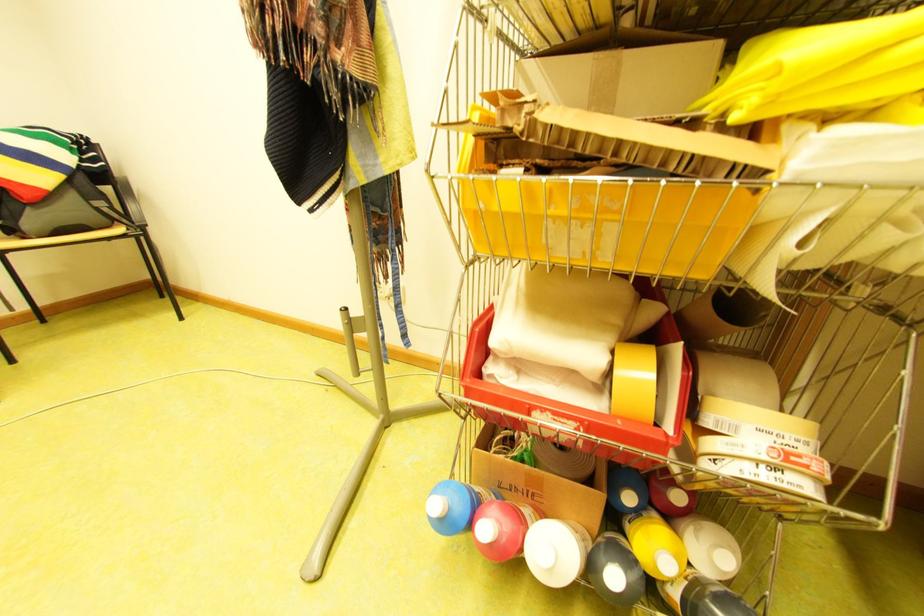
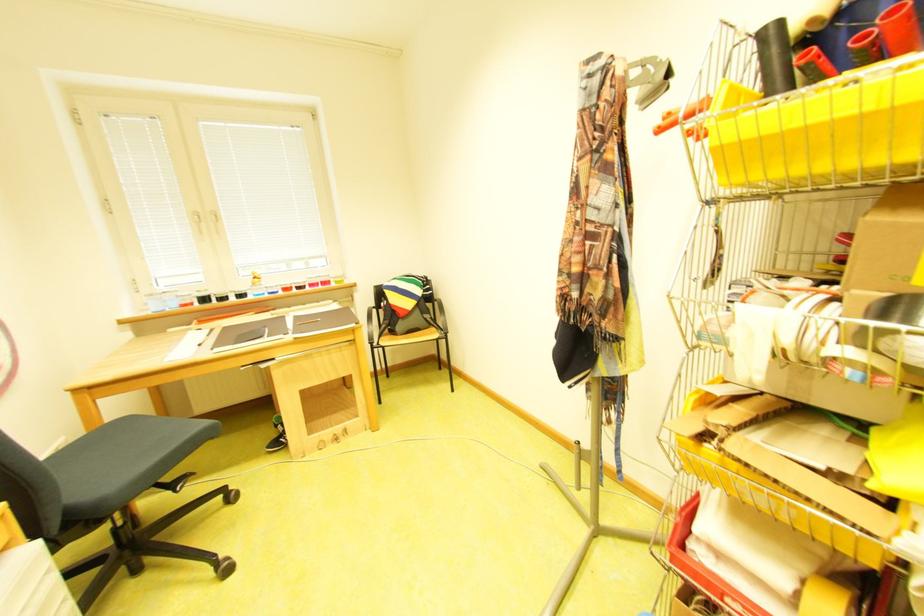
Where in the second image is the point corresponding to pixel 554 411 from the first image?

(746, 600)